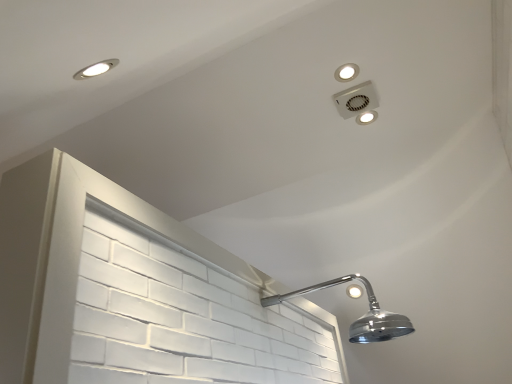
Image resolution: width=512 pixels, height=384 pixels. What do you see at coordinates (346, 72) in the screenshot?
I see `white plastic light fixture at upper center, acting as the 2th dot starting from the right` at bounding box center [346, 72].

In order to face matte white light fixture at upper right, the first dot viewed from the right, should I rotate leftwards or rightwards?

It's best to rotate right around 14.606 degrees.

In order to click on white plastic light fixture at upper center, acting as the 2th dot starting from the right in this screenshot , I will do `click(346, 72)`.

From a real-world perspective, is white plastic light fixture at upper center, which is counted as the 2th dot, starting from the back, positioned above or below white plastic vent at upper right?

Clearly, from a real-world perspective, white plastic light fixture at upper center, which is counted as the 2th dot, starting from the back, is above white plastic vent at upper right.

Is white plastic light fixture at upper center, which is the 1th dot in top-to-bottom order, next to white plastic vent at upper right and touching it?

No, white plastic light fixture at upper center, which is the 1th dot in top-to-bottom order, is not next to white plastic vent at upper right.

In the scene shown: What's the angular difference between white plastic light fixture at upper center, the 1th dot in the front-to-back sequence, and white plastic vent at upper right's facing directions?

They differ by 0.0892 degrees in their facing directions.

Considering the sizes of white plastic light fixture at upper center, which ranks as the 2th dot in bottom-to-top order, and white plastic vent at upper right in the image, is white plastic light fixture at upper center, which ranks as the 2th dot in bottom-to-top order, taller or shorter than white plastic vent at upper right?

In the image, white plastic light fixture at upper center, which ranks as the 2th dot in bottom-to-top order, appears to be shorter than white plastic vent at upper right.

Between white plastic vent at upper right and white plastic light fixture at upper center, the first dot viewed from the left, which one has larger size?

white plastic vent at upper right.

Considering the relative sizes of white plastic vent at upper right and white plastic light fixture at upper center, the 1th dot in the front-to-back sequence, in the image provided, is white plastic vent at upper right thinner than white plastic light fixture at upper center, the 1th dot in the front-to-back sequence,?

No, white plastic vent at upper right is not thinner than white plastic light fixture at upper center, the 1th dot in the front-to-back sequence.

What's the angular difference between white plastic vent at upper right and white plastic light fixture at upper center, which ranks as the 2th dot in bottom-to-top order,'s facing directions?

They differ by 0.0892 degrees in their facing directions.

Is white plastic vent at upper right to the left or to the right of white plastic light fixture at upper center, which is the 1th dot in top-to-bottom order, in the image?

Based on their positions, white plastic vent at upper right is located to the right of white plastic light fixture at upper center, which is the 1th dot in top-to-bottom order.

Where is `dot on the left of matte white light fixture at upper right, which appears as the 1th dot when viewed from the back`? This screenshot has height=384, width=512. dot on the left of matte white light fixture at upper right, which appears as the 1th dot when viewed from the back is located at coordinates (346, 72).

Who is taller, white plastic light fixture at upper center, the 1th dot in the front-to-back sequence, or matte white light fixture at upper right, which ranks as the second dot in top-to-bottom order?

With more height is white plastic light fixture at upper center, the 1th dot in the front-to-back sequence.

How different are the orientations of white plastic light fixture at upper center, which ranks as the 2th dot in bottom-to-top order, and matte white light fixture at upper right, the 1th dot in the bottom-to-top sequence, in degrees?

The angular difference between white plastic light fixture at upper center, which ranks as the 2th dot in bottom-to-top order, and matte white light fixture at upper right, the 1th dot in the bottom-to-top sequence, is 0.00179 degrees.

Is white plastic light fixture at upper center, which is counted as the 2th dot, starting from the back, located outside matte white light fixture at upper right, the second dot when ordered from front to back?

white plastic light fixture at upper center, which is counted as the 2th dot, starting from the back, is positioned outside matte white light fixture at upper right, the second dot when ordered from front to back.

Which is closer, (341, 68) or (367, 115)?

The point (341, 68) is closer.

From the image's perspective, is white plastic vent at upper right positioned above or below matte white light fixture at upper right, which appears as the 1th dot when viewed from the back?

Based on their image positions, white plastic vent at upper right is located above matte white light fixture at upper right, which appears as the 1th dot when viewed from the back.

At what (x,y) coordinates should I click in order to perform the action: click on fixture that appears on the left of matte white light fixture at upper right, the first dot viewed from the right. Please return your answer as a coordinate pair (x, y). This screenshot has width=512, height=384. Looking at the image, I should click on (358, 102).

Is white plastic vent at upper right to the left or to the right of matte white light fixture at upper right, which appears as the 1th dot when viewed from the back, in the image?

white plastic vent at upper right is positioned on matte white light fixture at upper right, which appears as the 1th dot when viewed from the back,'s left side.

Is point (360, 119) positioned in front of point (369, 117)?

No, (360, 119) is further to viewer.

Is the depth of matte white light fixture at upper right, the 1th dot in the bottom-to-top sequence, greater than that of white plastic vent at upper right?

Yes, matte white light fixture at upper right, the 1th dot in the bottom-to-top sequence, is further from the camera.

Is matte white light fixture at upper right, which ranks as the second dot in top-to-bottom order, turned away from white plastic vent at upper right?

That's not correct — matte white light fixture at upper right, which ranks as the second dot in top-to-bottom order, is not looking away from white plastic vent at upper right.

I want to click on the 2nd dot above the white plastic vent at upper right (from a real-world perspective), so click(x=366, y=117).

Consider the image. From the image's perspective, is matte white light fixture at upper right, the 1th dot in the bottom-to-top sequence, on white plastic light fixture at upper center, the first dot viewed from the left?

Actually, matte white light fixture at upper right, the 1th dot in the bottom-to-top sequence, appears below white plastic light fixture at upper center, the first dot viewed from the left, in the image.

In the image, is matte white light fixture at upper right, the second dot when ordered from front to back, on the left side or the right side of white plastic light fixture at upper center, which ranks as the 2th dot in bottom-to-top order?

matte white light fixture at upper right, the second dot when ordered from front to back, is positioned on white plastic light fixture at upper center, which ranks as the 2th dot in bottom-to-top order,'s right side.

Locate an element on the screen. Image resolution: width=512 pixels, height=384 pixels. dot below the white plastic light fixture at upper center, which ranks as the 2th dot in bottom-to-top order (from the image's perspective) is located at coordinates (366, 117).

Is matte white light fixture at upper right, the second dot when ordered from front to back, oriented away from white plastic light fixture at upper center, which is the 1th dot in top-to-bottom order?

matte white light fixture at upper right, the second dot when ordered from front to back, is not turned away from white plastic light fixture at upper center, which is the 1th dot in top-to-bottom order.

Identify the location of fixture below the white plastic light fixture at upper center, acting as the 2th dot starting from the right (from a real-world perspective). This screenshot has height=384, width=512. (358, 102).

Locate an element on the screen. fixture on the right of white plastic light fixture at upper center, the 1th dot in the front-to-back sequence is located at coordinates [358, 102].

From the image, which object appears to be farther from matte white light fixture at upper right, the first dot viewed from the right, white plastic vent at upper right or white plastic light fixture at upper center, the 1th dot in the front-to-back sequence?

white plastic light fixture at upper center, the 1th dot in the front-to-back sequence.

From the image, which object appears to be farther from matte white light fixture at upper right, which is counted as the second dot, starting from the left, white plastic light fixture at upper center, the 1th dot in the front-to-back sequence, or white plastic vent at upper right?

Based on the image, white plastic light fixture at upper center, the 1th dot in the front-to-back sequence, appears to be further to matte white light fixture at upper right, which is counted as the second dot, starting from the left.

Estimate the real-world distances between objects in this image. Which object is closer to white plastic vent at upper right, matte white light fixture at upper right, which is counted as the second dot, starting from the left, or white plastic light fixture at upper center, which is the 1th dot in top-to-bottom order?

matte white light fixture at upper right, which is counted as the second dot, starting from the left, is positioned closer to the anchor white plastic vent at upper right.

Estimate the real-world distances between objects in this image. Which object is closer to white plastic light fixture at upper center, which is counted as the 2th dot, starting from the back, white plastic vent at upper right or matte white light fixture at upper right, the 1th dot in the bottom-to-top sequence?

white plastic vent at upper right is closer to white plastic light fixture at upper center, which is counted as the 2th dot, starting from the back.

Based on their spatial positions, is matte white light fixture at upper right, which appears as the 1th dot when viewed from the back, or white plastic vent at upper right closer to white plastic light fixture at upper center, the 1th dot in the front-to-back sequence?

white plastic vent at upper right.

From the image, which object appears to be nearer to white plastic vent at upper right, white plastic light fixture at upper center, acting as the 2th dot starting from the right, or matte white light fixture at upper right, which appears as the 1th dot when viewed from the back?

matte white light fixture at upper right, which appears as the 1th dot when viewed from the back, is closer to white plastic vent at upper right.

Identify the location of fixture between white plastic light fixture at upper center, the 1th dot in the front-to-back sequence, and matte white light fixture at upper right, which appears as the 1th dot when viewed from the back, in the front-back direction. (358, 102).